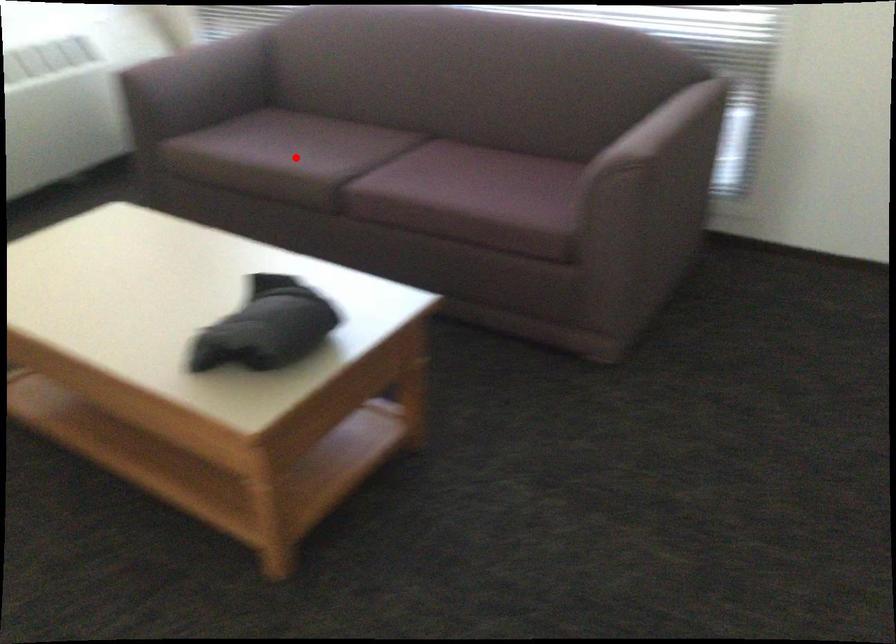
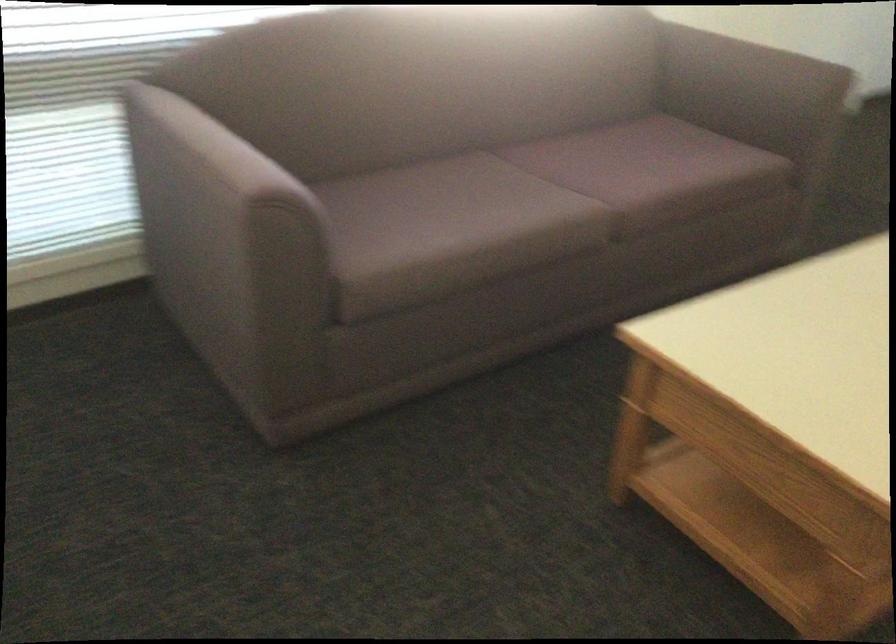
Locate, in the second image, the point that corresponds to the highlighted location in the first image.

(528, 205)